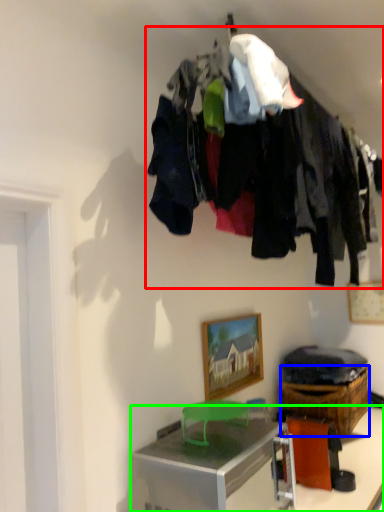
Question: Considering the real-world distances, which object is farthest from closet (highlighted by a red box)? crate (highlighted by a blue box) or desk (highlighted by a green box)?

Choices:
 (A) crate
 (B) desk

Answer: (A)